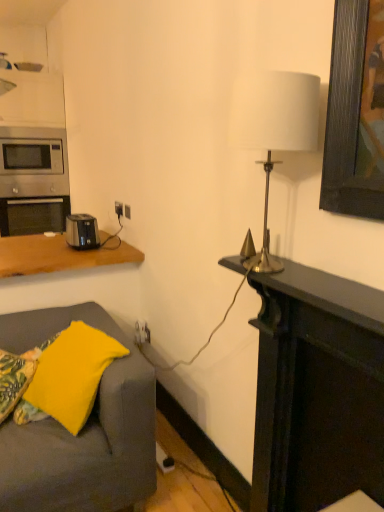
Question: Considering the positions of black plastic toaster at left and stainless steel oven at left in the image, is black plastic toaster at left bigger or smaller than stainless steel oven at left?

Choices:
 (A) small
 (B) big

Answer: (A)

Question: Would you say black plastic toaster at left is inside or outside stainless steel oven at left?

Choices:
 (A) inside
 (B) outside

Answer: (B)

Question: Which object is the farthest from the yellow fabric pillow at lower left, marked as the 2th pillow in a right-to-left arrangement?

Choices:
 (A) white fabric lampshade at upper right
 (B) dark wood fireplace at right
 (C) black plastic outlet at center
 (D) black plastic toaster at left
 (E) satin silver microwave at left

Answer: (E)

Question: Estimate the real-world distances between objects in this image. Which object is farther from the dark wood fireplace at right?

Choices:
 (A) stainless steel oven at left
 (B) satin silver microwave at left
 (C) yellow fabric pillow at lower left, the 1th pillow when ordered from right to left
 (D) yellow fabric pillow at lower left, marked as the 1th pillow in a left-to-right arrangement
 (E) white fabric lampshade at upper right

Answer: (B)